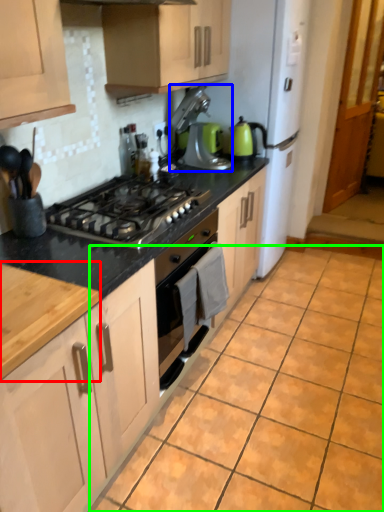
Question: Considering the real-world distances, which object is farthest from countertop (highlighted by a red box)? kitchen appliance (highlighted by a blue box) or ceramic tile (highlighted by a green box)?

Choices:
 (A) kitchen appliance
 (B) ceramic tile

Answer: (A)